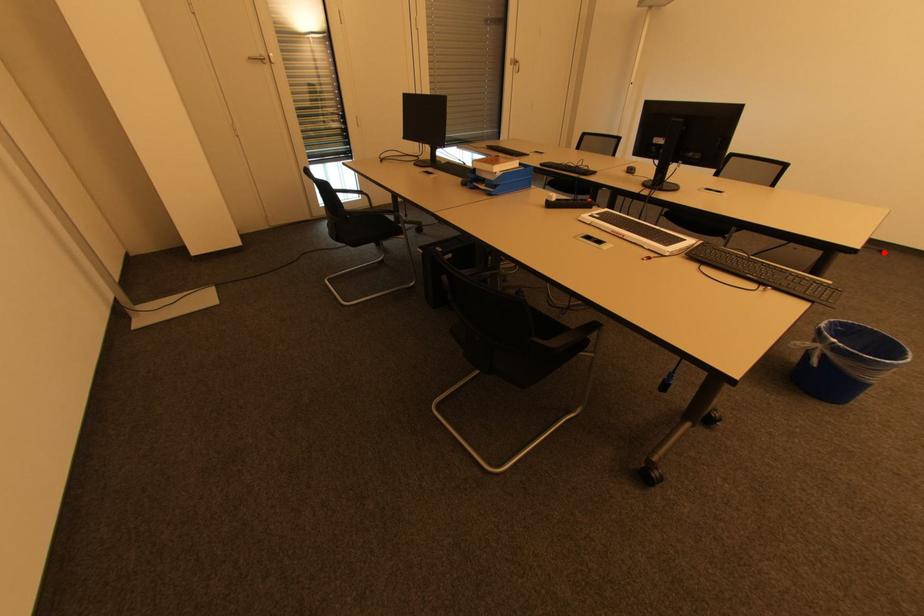
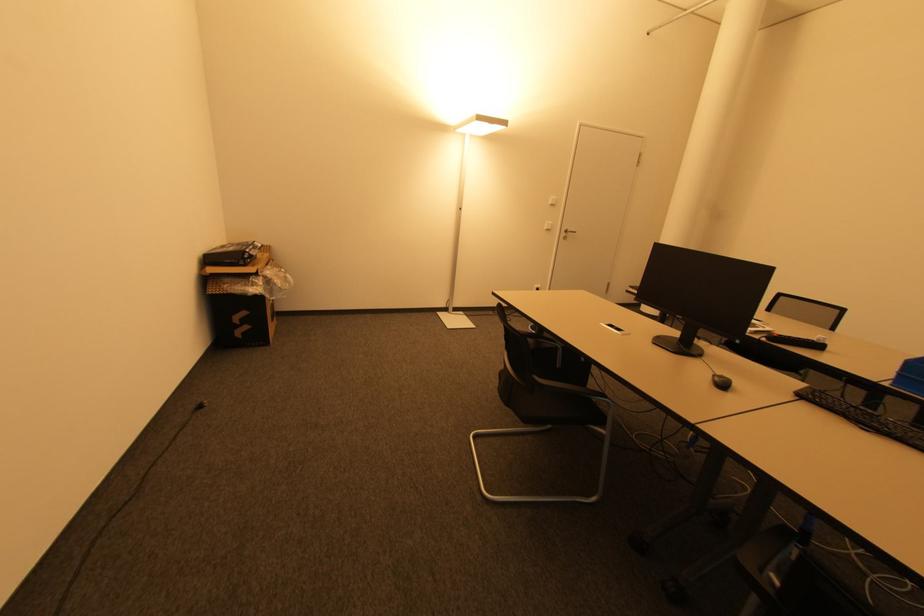
Find the pixel in the second image that matches the highlighted location in the first image.

(201, 408)